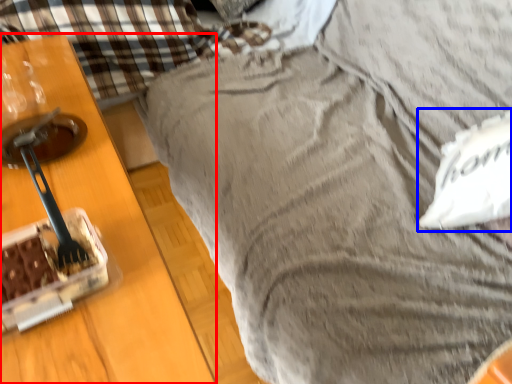
Question: Which object is closer to the camera taking this photo, furniture (highlighted by a red box) or pillow (highlighted by a blue box)?

Choices:
 (A) furniture
 (B) pillow

Answer: (A)